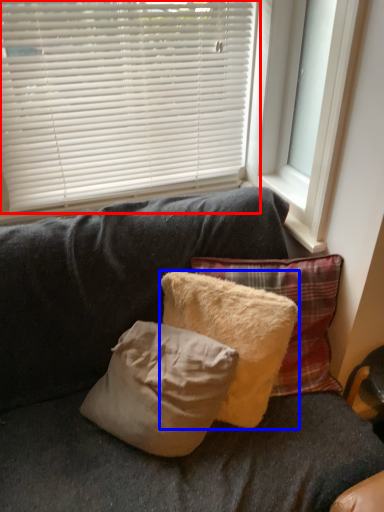
Question: Which object is closer to the camera taking this photo, window blind (highlighted by a red box) or pillow (highlighted by a blue box)?

Choices:
 (A) window blind
 (B) pillow

Answer: (B)